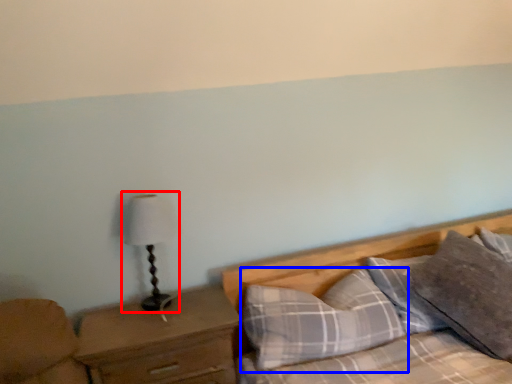
Question: Which object appears closest to the camera in this image, table lamp (highlighted by a red box) or pillow (highlighted by a blue box)?

Choices:
 (A) table lamp
 (B) pillow

Answer: (B)